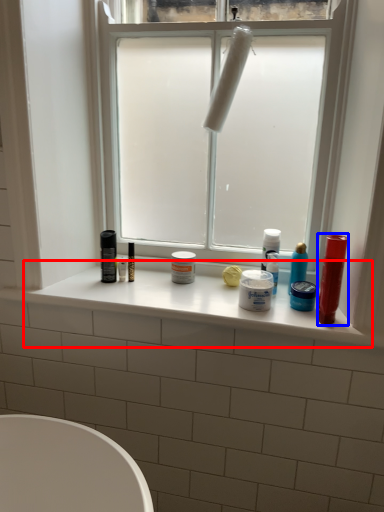
Question: Which point is closer to the camera, window sill (highlighted by a red box) or lip balm (highlighted by a blue box)?

Choices:
 (A) window sill
 (B) lip balm

Answer: (B)